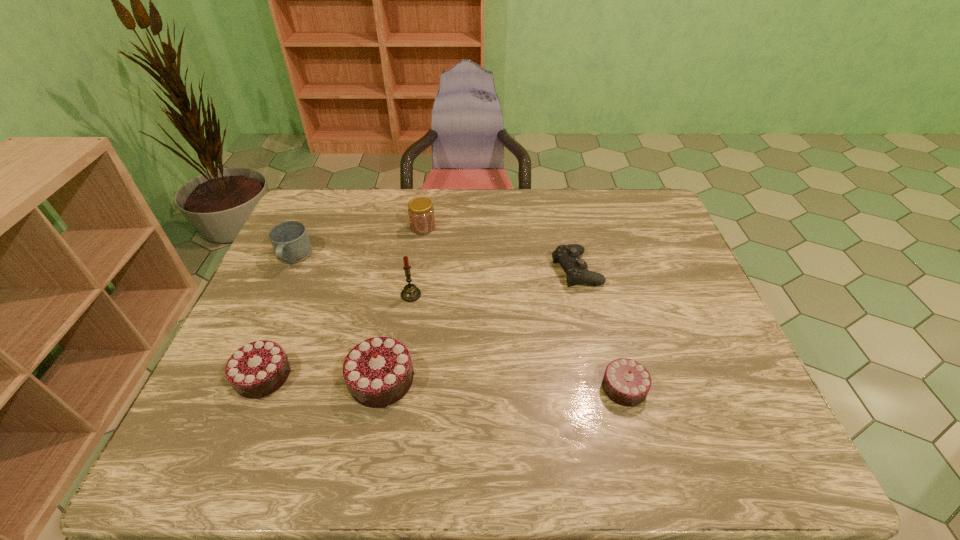
Locate an element on the screen. Image resolution: width=960 pixels, height=540 pixels. the leftmost chocolate cake is located at coordinates (256, 370).

Locate an element on the screen. The image size is (960, 540). the second chocolate cake from right to left is located at coordinates (378, 372).

I want to click on the rightmost chocolate cake, so click(626, 382).

This screenshot has width=960, height=540. I want to click on the farthest object, so click(x=421, y=213).

Find the location of a particular element. Image resolution: width=960 pixels, height=540 pixels. control is located at coordinates (576, 269).

In order to click on the tallest object in this screenshot , I will do `click(410, 293)`.

This screenshot has width=960, height=540. Identify the location of mug. (290, 241).

The width and height of the screenshot is (960, 540). What are the coordinates of `vacant area located on the back of the second tallest chocolate cake` in the screenshot? It's located at (286, 319).

Identify the location of vacant area situated 0.270m on the back of the tallest chocolate cake. (401, 275).

You are a GUI agent. You are given a task and a screenshot of the screen. Output one action in this format:
    pyautogui.click(x=<x>, y=<y>)
    Task: Click on the free space located 0.260m on the left of the shortest chocolate cake
    This screenshot has width=960, height=540.
    Given the screenshot: What is the action you would take?
    pyautogui.click(x=487, y=388)